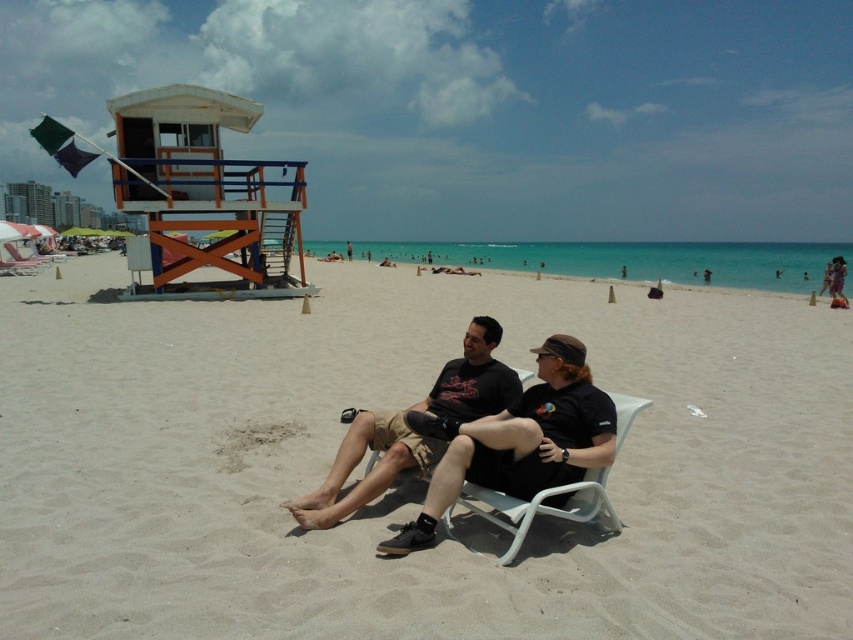
You are a photographer standing at the edge of the beach. You want to take a photo of the light beige sand at center and the black fabric shirt at center. Which object will appear closer to the camera in the photo?

The light beige sand at center is in front of the black fabric shirt at center, so it will appear closer to the camera in the photo.